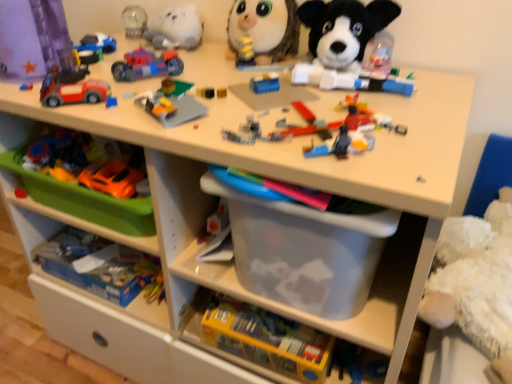
You are a GUI agent. You are given a task and a screenshot of the screen. Output one action in this format:
    pyautogui.click(x=<x>, y=<y>)
    Task: Click on the vacant space behind matte plastic car at upper left, which is the fifth toy from top to bottom
    This screenshot has width=512, height=384.
    Given the screenshot: What is the action you would take?
    pyautogui.click(x=100, y=73)